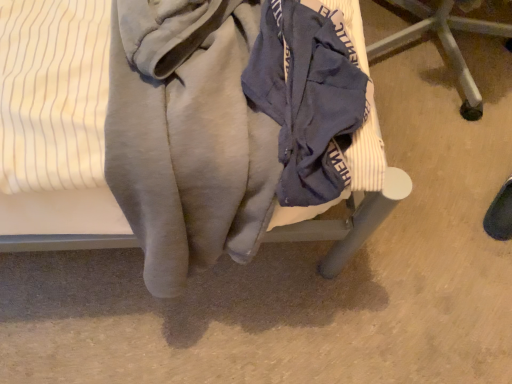
Question: Do you think blue fabric chair at center, which is counted as the first furniture, starting from the right, is within navy blue fabric at center, or outside of it?

Choices:
 (A) inside
 (B) outside

Answer: (B)

Question: Considering the positions of blue fabric chair at center, which is the 2th furniture in left-to-right order, and navy blue fabric at center in the image, is blue fabric chair at center, which is the 2th furniture in left-to-right order, wider or thinner than navy blue fabric at center?

Choices:
 (A) thin
 (B) wide

Answer: (B)

Question: Which of these objects is positioned farthest from the velvet-like fabric chair at center, the second furniture when ordered from right to left?

Choices:
 (A) navy blue fabric at center
 (B) blue fabric chair at center, which is the 2th furniture in left-to-right order

Answer: (B)

Question: Which object is the closest to the navy blue fabric at center?

Choices:
 (A) blue fabric chair at center, which is the 2th furniture in left-to-right order
 (B) velvet-like fabric chair at center, the first furniture in the left-to-right sequence

Answer: (B)